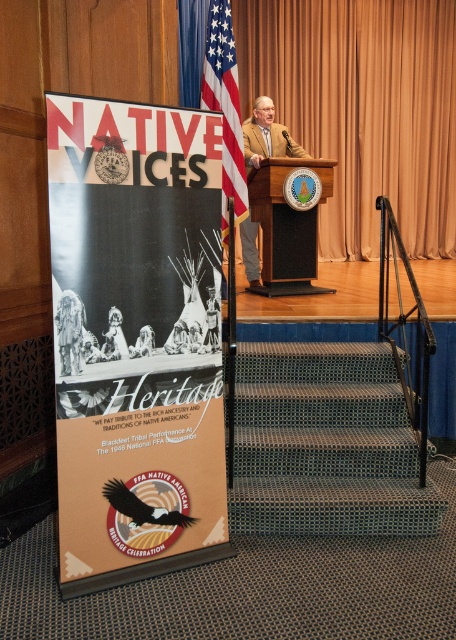
What is the position of the tan leather jacket at center relative to the blue textured carpet at lower right?

The tan leather jacket at center is positioned above the blue textured carpet at lower right.

You are an event organizer who needs to place a new decorative item between the matte cardboard poster at left and the blue textured carpet at lower right. Based on their positions, which object should the new item be closer to?

The new decorative item should be placed closer to the blue textured carpet at lower right since the matte cardboard poster at left is positioned on the left side of the blue textured carpet at lower right.